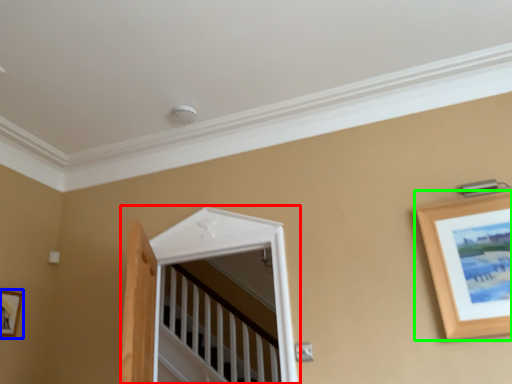
Question: Which is nearer to the window (highlighted by a red box)? picture frame (highlighted by a blue box) or picture frame (highlighted by a green box).

Choices:
 (A) picture frame
 (B) picture frame

Answer: (B)